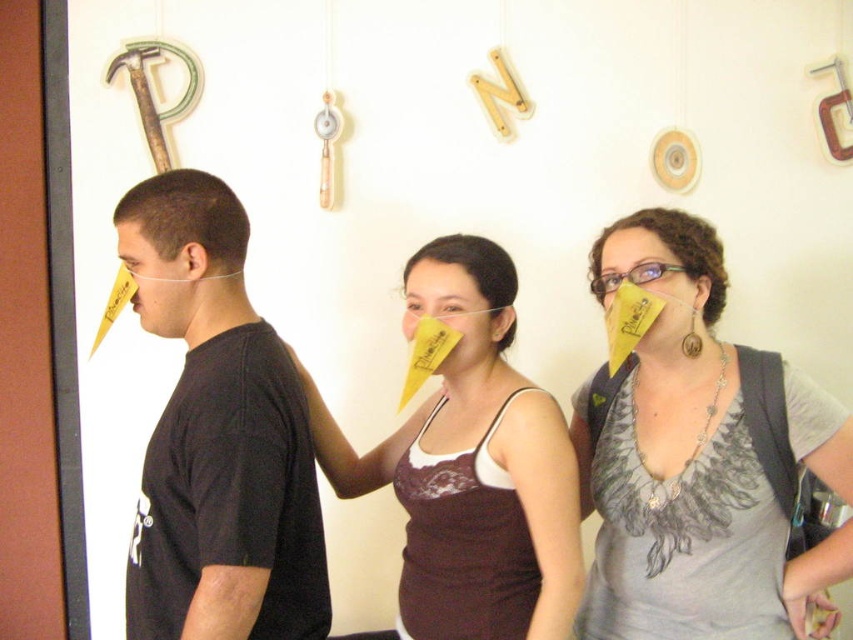
Which is above, yellow paper cone at center or black matte t-shirt at left?

Positioned higher is black matte t-shirt at left.

Does yellow paper cone at center have a greater width compared to black matte t-shirt at left?

Correct, the width of yellow paper cone at center exceeds that of black matte t-shirt at left.

Who is more distant from viewer, (x=664, y=596) or (x=206, y=445)?

The point (x=664, y=596) is more distant.

What are the coordinates of `yellow paper cone at center` in the screenshot? It's located at (699, 460).

Does yellow paper cone at center appear over matte yellow paper cone at center?

Indeed, yellow paper cone at center is positioned over matte yellow paper cone at center.

Identify the location of yellow paper cone at center. The image size is (853, 640). (699, 460).

Which is behind, point (752, 493) or point (445, 602)?

Positioned behind is point (445, 602).

Locate an element on the screen. This screenshot has height=640, width=853. yellow paper cone at center is located at coordinates (699, 460).

Between point (254, 316) and point (451, 410), which one is positioned in front?

Positioned in front is point (254, 316).

From the picture: Which of these two, black matte t-shirt at left or matte yellow paper cone at center, stands taller?

black matte t-shirt at left is taller.

Is point (300, 576) more distant than point (432, 458)?

No, it is not.

Locate an element on the screen. Image resolution: width=853 pixels, height=640 pixels. black matte t-shirt at left is located at coordinates (218, 435).